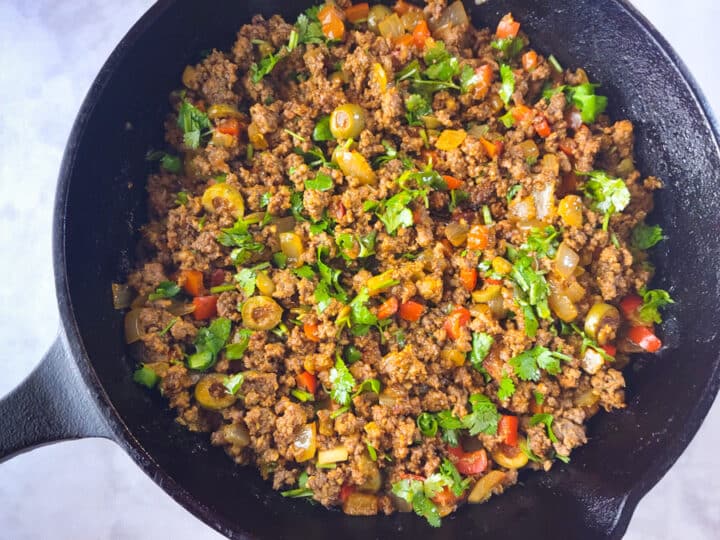
Locate an element on the screen. The height and width of the screenshot is (540, 720). table is located at coordinates (44, 117).